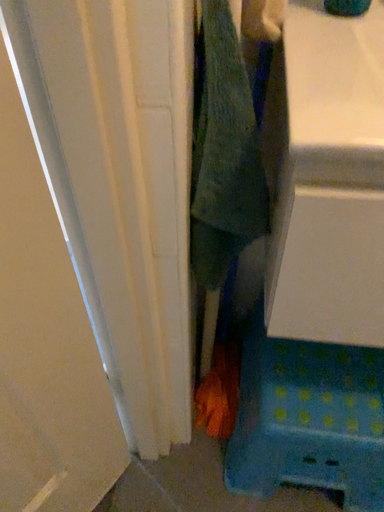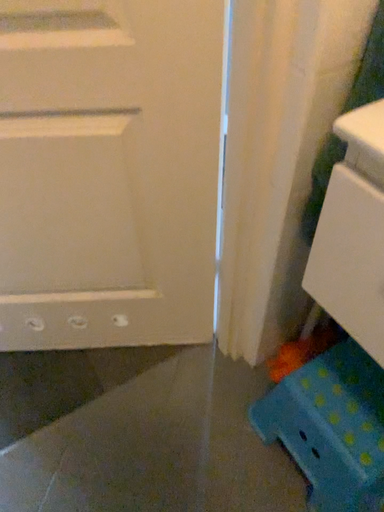
Question: Which way did the camera rotate in the video?

Choices:
 (A) rotated downward
 (B) rotated upward

Answer: (B)